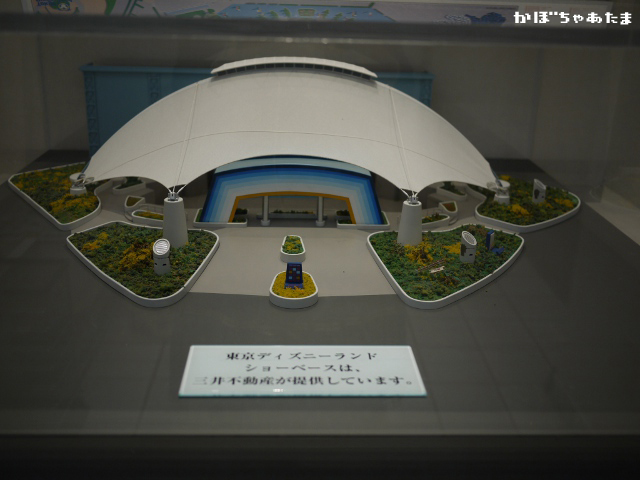
Find the location of `light fixtures`. light fixtures is located at coordinates (80, 178), (161, 250), (468, 243), (537, 188).